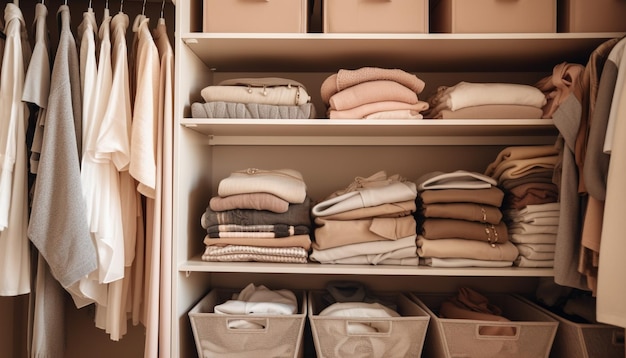
This screenshot has height=358, width=626. In order to click on baskets on the right in this screenshot , I will do `click(520, 14)`, `click(585, 13)`, `click(483, 343)`, `click(585, 335)`.